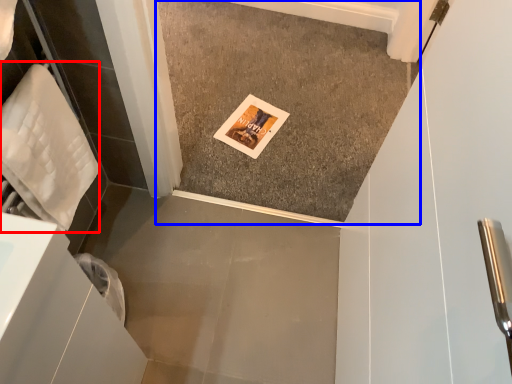
Question: Which object appears closest to the camera in this image, material (highlighted by a red box) or concrete (highlighted by a blue box)?

Choices:
 (A) material
 (B) concrete

Answer: (A)